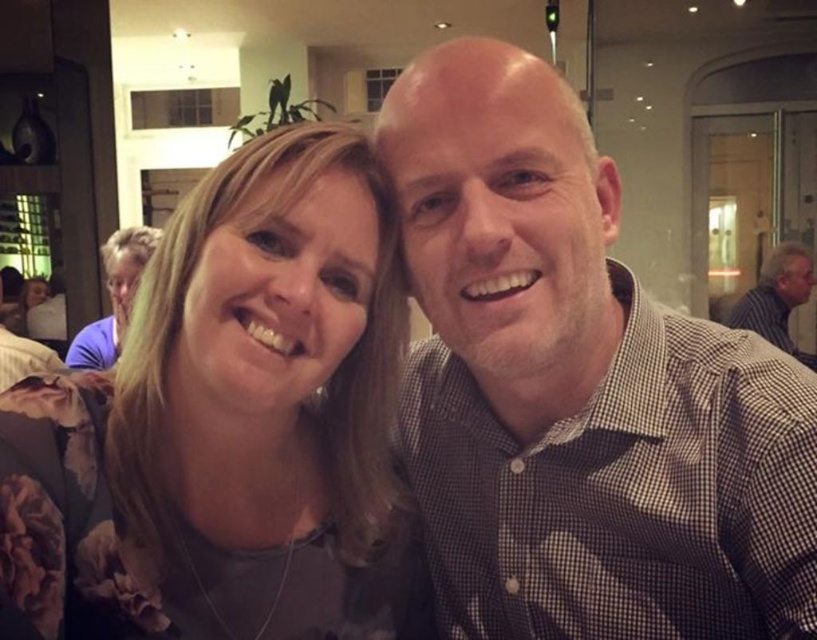
Question: Among these objects, which one is farthest from the camera?

Choices:
 (A) striped shirt at right
 (B) floral fabric shirt at left

Answer: (A)

Question: Which object appears farthest from the camera in this image?

Choices:
 (A) checkered fabric shirt at center
 (B) striped shirt at right

Answer: (B)

Question: Is floral fabric shirt at left further to the viewer compared to matte purple shirt at upper left?

Choices:
 (A) no
 (B) yes

Answer: (A)

Question: Observing the image, what is the correct spatial positioning of checkered fabric shirt at center in reference to matte purple shirt at upper left?

Choices:
 (A) right
 (B) left

Answer: (A)

Question: Does checkered fabric shirt at center have a greater width compared to striped shirt at right?

Choices:
 (A) no
 (B) yes

Answer: (A)

Question: Among these points, which one is nearest to the camera?

Choices:
 (A) (161, 580)
 (B) (121, 244)

Answer: (A)